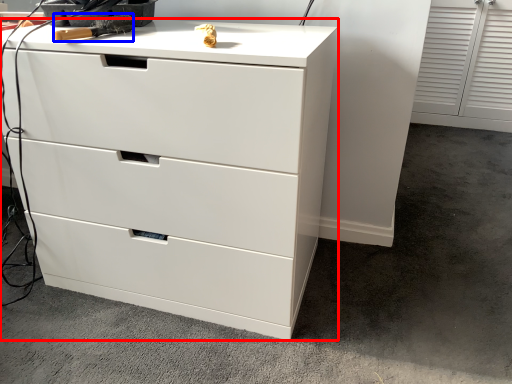
Question: Among these objects, which one is farthest to the camera, chest of drawers (highlighted by a red box) or tool (highlighted by a blue box)?

Choices:
 (A) chest of drawers
 (B) tool

Answer: (B)